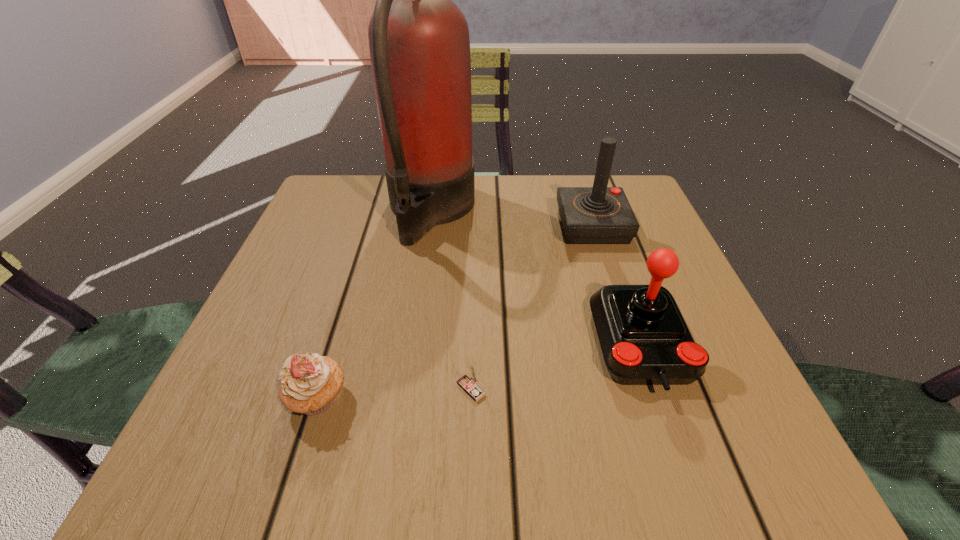
Find the location of `blank space located on the back of the fourth tallest object`. blank space located on the back of the fourth tallest object is located at coordinates (341, 324).

The height and width of the screenshot is (540, 960). Find the location of `vacant space located on the back of the shortest object`. vacant space located on the back of the shortest object is located at coordinates (474, 251).

The height and width of the screenshot is (540, 960). In order to click on fire extinguisher that is at the far edge in this screenshot , I will do coord(419,43).

Where is `joystick that is at the far edge`? joystick that is at the far edge is located at coordinates (590, 215).

Find the location of a particular element. The width and height of the screenshot is (960, 540). object present at the near edge is located at coordinates (309, 385).

Locate an element on the screen. object that is at the left edge is located at coordinates (309, 385).

Locate an element on the screen. object at the near left corner is located at coordinates (309, 385).

At what (x,y) coordinates should I click in order to perform the action: click on object situated at the far right corner. Please return your answer as a coordinate pair (x, y). Image resolution: width=960 pixels, height=540 pixels. Looking at the image, I should click on (590, 215).

Locate an element on the screen. vacant space at the far edge of the desktop is located at coordinates (503, 228).

In the image, there is a desktop. Identify the location of vacant space at the near edge. The height and width of the screenshot is (540, 960). (389, 463).